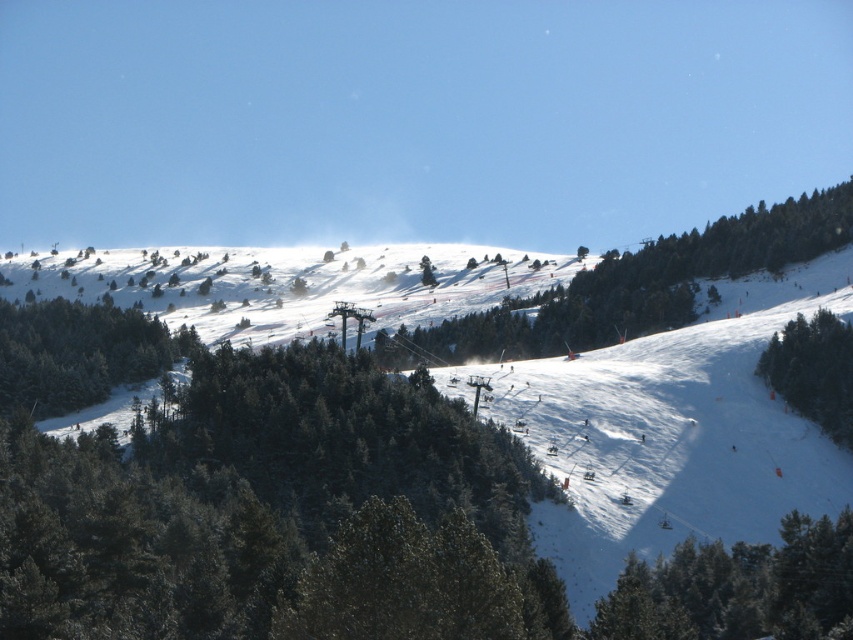
Based on the photo, can you confirm if green matte tree at lower right is taller than green matte tree at right?

In fact, green matte tree at lower right may be shorter than green matte tree at right.

Does green matte tree at lower right have a lesser width compared to green matte tree at right?

In fact, green matte tree at lower right might be wider than green matte tree at right.

Is point (729, 570) positioned in front of point (798, 321)?

Yes, it is.

Locate an element on the screen. green matte tree at lower right is located at coordinates (738, 588).

Which of these two, white powdery snow at upper center or green matte tree at lower right, stands shorter?

green matte tree at lower right

Is white powdery snow at upper center taller than green matte tree at lower right?

Indeed, white powdery snow at upper center has a greater height compared to green matte tree at lower right.

What do you see at coordinates (291, 284) in the screenshot?
I see `white powdery snow at upper center` at bounding box center [291, 284].

I want to click on white powdery snow at upper center, so point(291,284).

Can you confirm if green matte tree at center is positioned below green matte tree at left?

Actually, green matte tree at center is above green matte tree at left.

Is green matte tree at center positioned at the back of green matte tree at left?

Yes, green matte tree at center is behind green matte tree at left.

Does point (613, 310) lie behind point (109, 321)?

Yes.

Where is `green matte tree at center`? The width and height of the screenshot is (853, 640). green matte tree at center is located at coordinates (634, 285).